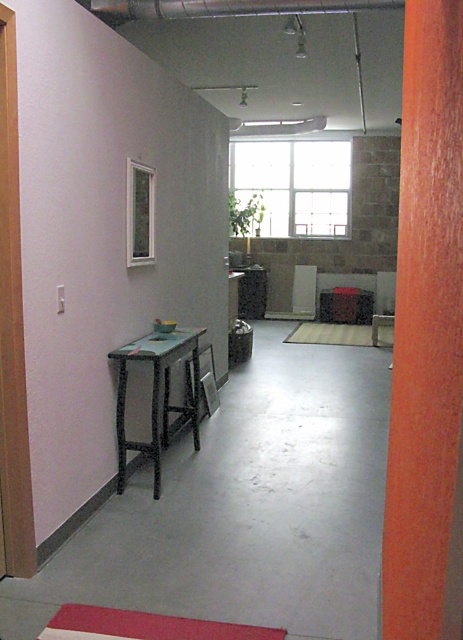
You are a delivery person who needs to place a large package that is 3 meters long in this space. Can you fit the package horizontally between the orange wood pillar at right and the matte wood chair at center without moving any furniture?

The distance between the orange wood pillar at right and the matte wood chair at center is 8.19 meters. Since the package is 3 meters long, it can easily fit horizontally between them as the available space is more than sufficient.